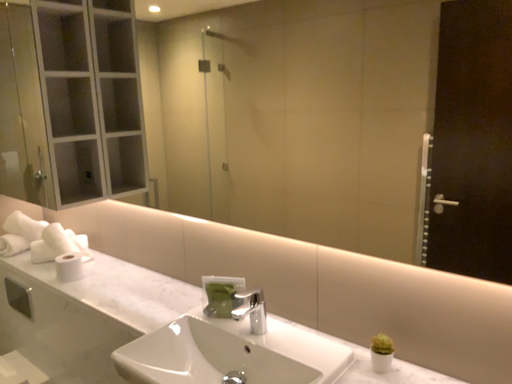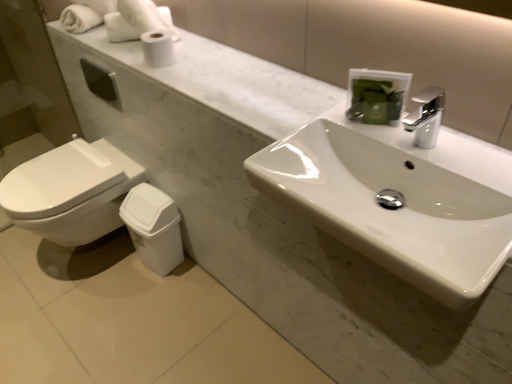
Question: Which way did the camera rotate in the video?

Choices:
 (A) rotated left
 (B) rotated right

Answer: (A)